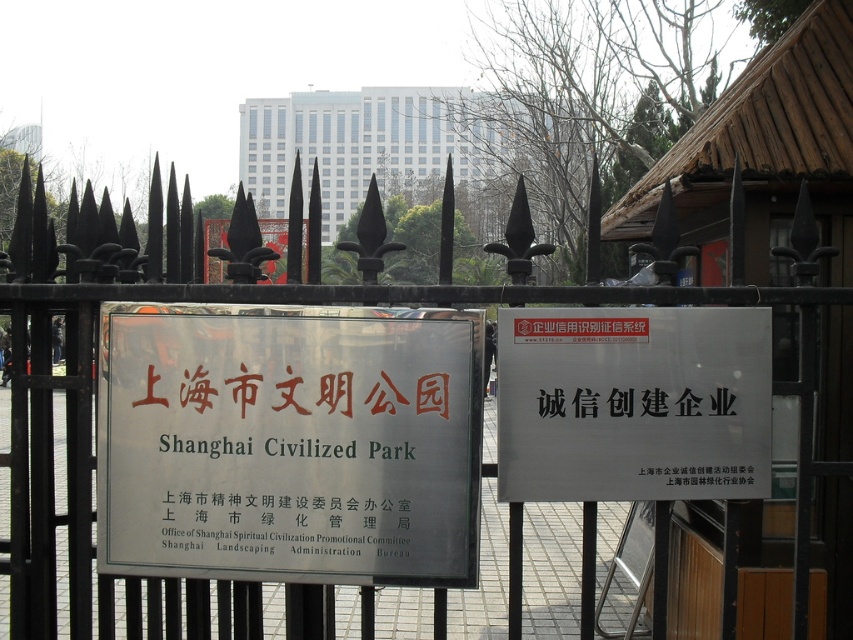
You are standing in front of the gate with two signs. You notice a white glass building at upper center and a black metallic sign at center. Which object is taller?

The white glass building at upper center is taller than the black metallic sign at center.

You are standing in front of the gate with two signs. You need to locate the white matte sign at center. According to the coordinates provided, where exactly should you look on the gate?

The white matte sign at center is located at point coordinates (633, 403) on the gate.

You are a visitor trying to find the entrance to the park. You see a wooden hut at center and a black paper sign at center. Which one is taller?

The wooden hut at center is taller than the black paper sign at center.